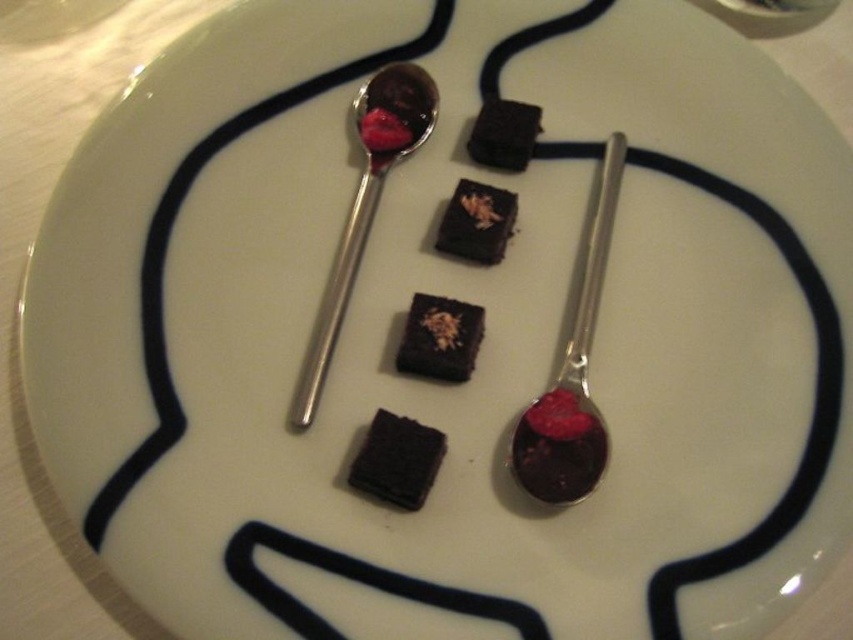
Question: Which point is farther to the camera?

Choices:
 (A) (416, 448)
 (B) (577, 426)
 (C) (399, 74)
 (D) (526, 120)

Answer: (C)

Question: Does silver metallic spoon at center appear under dark matte chocolate cake at center?

Choices:
 (A) yes
 (B) no

Answer: (B)

Question: Does dark matte chocolate cake at center appear on the left side of dark matte chocolate cake at upper center?

Choices:
 (A) no
 (B) yes

Answer: (B)

Question: Considering the real-world distances, which object is closest to the chocolate matte at center?

Choices:
 (A) shiny metal spoon at center right
 (B) dark matte chocolate cake at center

Answer: (A)

Question: Does silver metallic spoon at center have a larger size compared to dark matte chocolate cake at center?

Choices:
 (A) yes
 (B) no

Answer: (A)

Question: Which of the following is the farthest from the observer?

Choices:
 (A) (476, 157)
 (B) (479, 259)
 (C) (473, 305)
 (D) (524, 476)

Answer: (A)